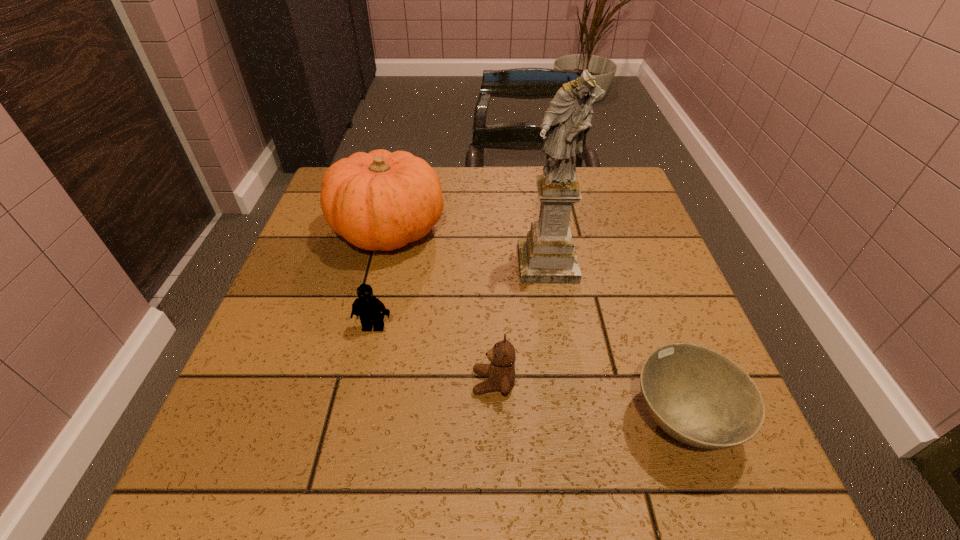
Identify the location of free spot located 0.080m at the face of the third object from right to left. (428, 382).

Where is `vacant space located 0.260m at the face of the third object from right to left`? vacant space located 0.260m at the face of the third object from right to left is located at coordinates (326, 382).

Find the location of a particular element. The image size is (960, 540). free space located 0.230m at the face of the third object from right to left is located at coordinates (344, 382).

The image size is (960, 540). Identify the location of free space located 0.220m on the back of the bowl. (635, 288).

Where is `object that is at the far edge`? Image resolution: width=960 pixels, height=540 pixels. object that is at the far edge is located at coordinates (381, 200).

Image resolution: width=960 pixels, height=540 pixels. Find the location of `object positioned at the near edge`. object positioned at the near edge is located at coordinates (698, 396).

The height and width of the screenshot is (540, 960). I want to click on object present at the left edge, so click(381, 200).

Where is `object present at the right edge`? This screenshot has width=960, height=540. object present at the right edge is located at coordinates (698, 396).

What are the coordinates of `object positioned at the far left corner` in the screenshot? It's located at (381, 200).

Where is `object that is at the near right corner`? object that is at the near right corner is located at coordinates (698, 396).